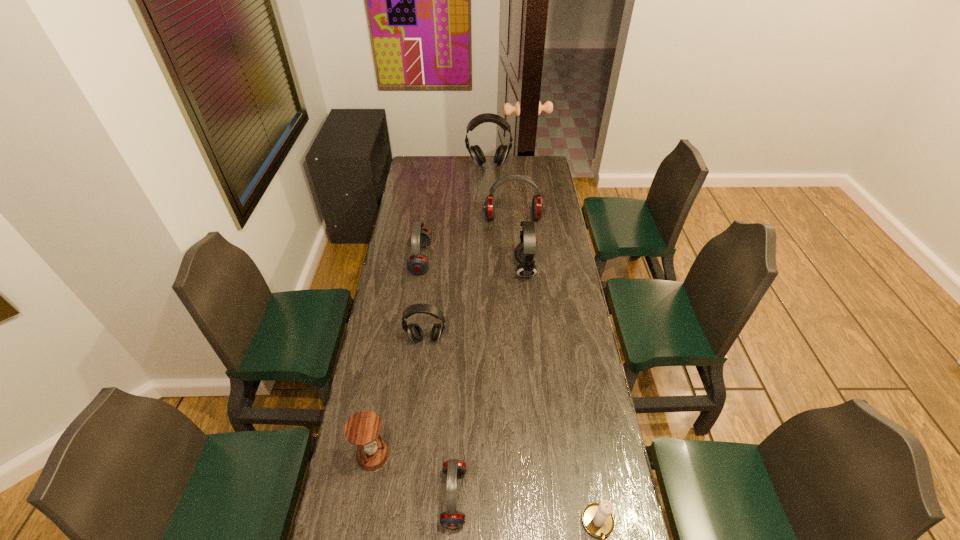
The width and height of the screenshot is (960, 540). In order to click on the farthest object in this screenshot , I will do `click(476, 153)`.

The image size is (960, 540). I want to click on the tallest object, so (x=476, y=153).

Identify the location of the fifth nearest earphone. The width and height of the screenshot is (960, 540). (538, 207).

This screenshot has height=540, width=960. I want to click on the rightmost red earphone, so click(538, 207).

This screenshot has width=960, height=540. I want to click on the second farthest black earphone, so click(x=525, y=251).

Where is `the second biggest red earphone`? This screenshot has height=540, width=960. the second biggest red earphone is located at coordinates (417, 264).

This screenshot has height=540, width=960. Identify the location of the second farthest red earphone. (417, 264).

The height and width of the screenshot is (540, 960). What are the coordinates of `the fifth farthest earphone` in the screenshot? It's located at (415, 332).

Where is `the smallest black earphone`? The width and height of the screenshot is (960, 540). the smallest black earphone is located at coordinates (415, 332).

Locate an element on the screen. This screenshot has width=960, height=540. hourglass is located at coordinates (362, 429).